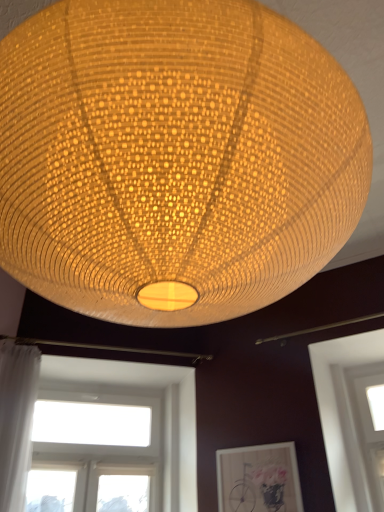
Question: Considering the positions of matte woven lampshade at center and transparent glass window at lower right, the first window from the right, in the image, is matte woven lampshade at center wider or thinner than transparent glass window at lower right, the first window from the right,?

Choices:
 (A) wide
 (B) thin

Answer: (A)

Question: From their relative heights in the image, would you say matte woven lampshade at center is taller or shorter than transparent glass window at lower right, the second window positioned from the left?

Choices:
 (A) short
 (B) tall

Answer: (B)

Question: Based on their relative distances, which object is nearer to the transparent glass window at lower right, the first window from the right?

Choices:
 (A) matte wooden picture frame at lower center
 (B) white glass window at lower left, marked as the second window in a right-to-left arrangement
 (C) white sheer curtain at left
 (D) matte woven lampshade at center

Answer: (A)

Question: Which object is the farthest from the transparent glass window at lower right, the first window from the right?

Choices:
 (A) matte woven lampshade at center
 (B) matte wooden picture frame at lower center
 (C) white glass window at lower left, marked as the first window in a left-to-right arrangement
 (D) white sheer curtain at left

Answer: (A)